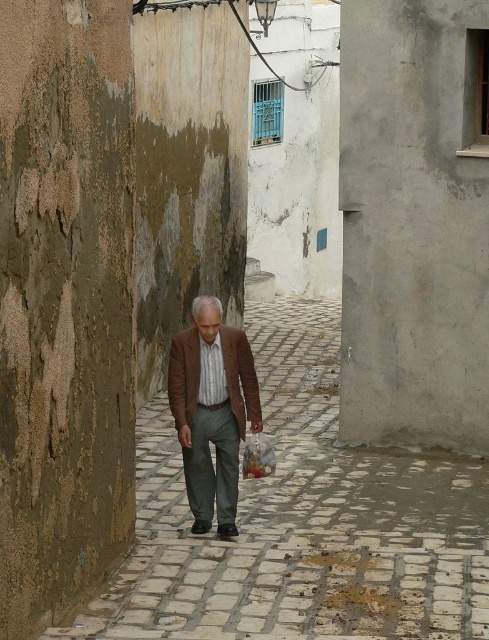
Who is shorter, white stone pavement at center or brown textured jacket at center?

Standing shorter between the two is white stone pavement at center.

Who is positioned more to the right, white stone pavement at center or brown textured jacket at center?

Positioned to the right is white stone pavement at center.

Is point (266, 481) closer to viewer compared to point (232, 404)?

No, (266, 481) is behind (232, 404).

Identify the location of white stone pavement at center. This screenshot has height=640, width=489. (302, 522).

How much distance is there between brown textured jacket at center and brown leather jacket at center?

5.18 inches

Between brown textured jacket at center and brown leather jacket at center, which one has more height?

brown textured jacket at center

Locate an element on the screen. The width and height of the screenshot is (489, 640). brown textured jacket at center is located at coordinates [x=212, y=410].

Identify the location of brown textured jacket at center. pyautogui.click(x=212, y=410).

Who is more forward, (247, 328) or (231, 387)?

Point (231, 387)

Is point (271, 493) farther from viewer compared to point (227, 372)?

Yes, point (271, 493) is farther from viewer.

Image resolution: width=489 pixels, height=640 pixels. Find the location of `white stone pavement at center`. white stone pavement at center is located at coordinates (302, 522).